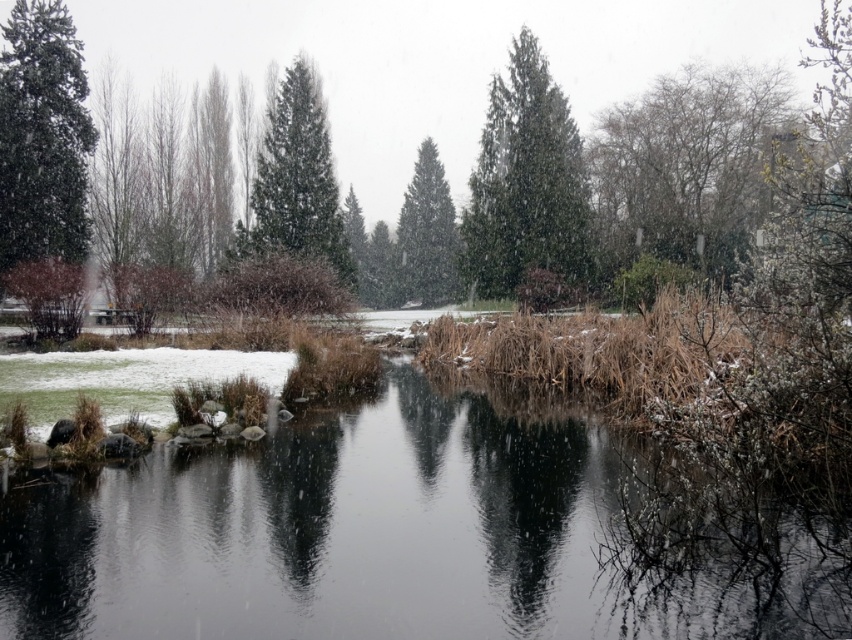
Is green textured pine tree at center above green matte tree at center?

No.

Does green textured pine tree at center appear on the right side of green matte tree at center?

Incorrect, green textured pine tree at center is not on the right side of green matte tree at center.

Between point (349, 262) and point (426, 157), which one is positioned in front?

Point (349, 262) is in front.

Image resolution: width=852 pixels, height=640 pixels. What are the coordinates of `green textured pine tree at center` in the screenshot? It's located at (296, 179).

Does green textured evergreen tree at center have a smaller size compared to green matte evergreen tree at left?

Correct, green textured evergreen tree at center occupies less space than green matte evergreen tree at left.

Which of these two, green textured evergreen tree at center or green matte evergreen tree at left, stands shorter?

Standing shorter between the two is green textured evergreen tree at center.

Locate an element on the screen. This screenshot has width=852, height=640. green textured evergreen tree at center is located at coordinates (527, 182).

Which is more to the right, bare branches at upper right or green matte tree at center?

bare branches at upper right is more to the right.

Which is in front, point (707, 99) or point (458, 243)?

Point (707, 99) is more forward.

Image resolution: width=852 pixels, height=640 pixels. What are the coordinates of `bare branches at upper right` in the screenshot? It's located at click(x=686, y=164).